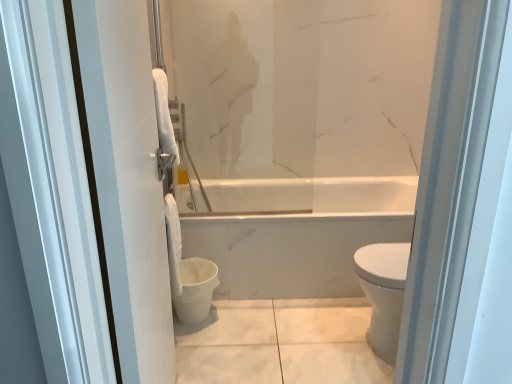
Question: In terms of width, does white fabric towel at lower center look wider or thinner when compared to white glossy towel at left?

Choices:
 (A) wide
 (B) thin

Answer: (B)

Question: From the image's perspective, is white fabric towel at lower center positioned above or below white glossy towel at left?

Choices:
 (A) below
 (B) above

Answer: (A)

Question: Estimate the real-world distances between objects in this image. Which object is farther from the white matte toilet bowl at lower center?

Choices:
 (A) white fabric towel at lower center
 (B) white glossy towel at left

Answer: (B)

Question: Based on their relative distances, which object is farther from the white fabric towel at lower center?

Choices:
 (A) white glossy towel at left
 (B) white matte toilet bowl at lower center

Answer: (A)